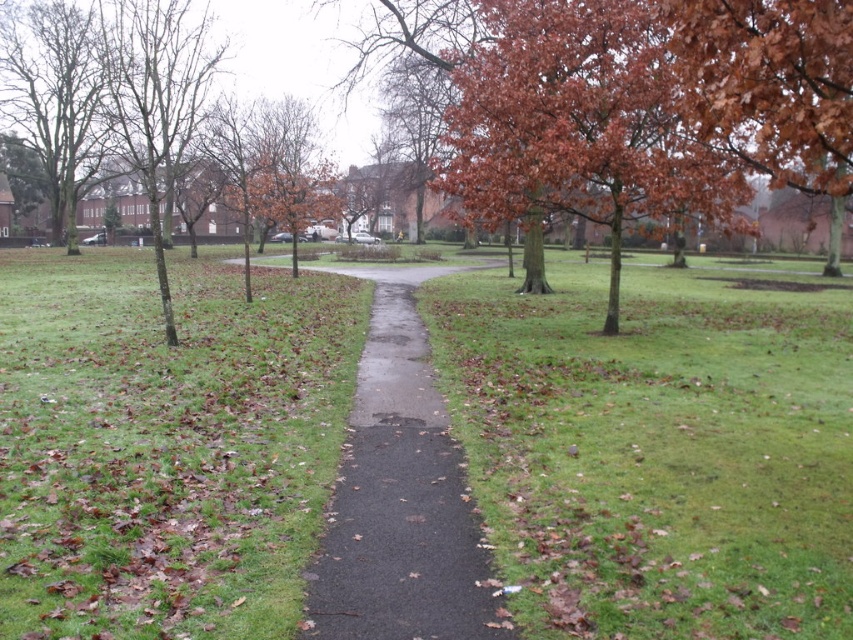
Consider the image. You are a gardener who needs to mow the lawn. You see the green grassy at center and the brown leafy tree at upper center. Which one is shorter?

The green grassy at center is shorter than the brown leafy tree at upper center.

You are a gardener planning to mow the green grassy at center. To avoid damaging the brown leafy tree at upper center, which direction should you move the lawnmower away from the tree?

The green grassy at center is located below the brown leafy tree at upper center, so you should move the lawnmower away from the tree in a downward direction to avoid damaging the tree.